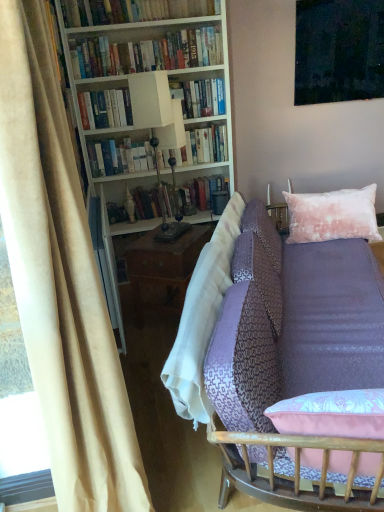
Question: Is hardcover books at center, which is the first book from bottom to top, touching lavender fabric couch at center?

Choices:
 (A) no
 (B) yes

Answer: (A)

Question: Can you confirm if hardcover books at center, which is the first book from bottom to top, is shorter than lavender fabric couch at center?

Choices:
 (A) yes
 (B) no

Answer: (A)

Question: From a real-world perspective, is hardcover books at center, which is the 4th book in top-to-bottom order, below lavender fabric couch at center?

Choices:
 (A) no
 (B) yes

Answer: (A)

Question: Is hardcover books at center, which is the first book from bottom to top, facing towards lavender fabric couch at center?

Choices:
 (A) no
 (B) yes

Answer: (A)

Question: Is the position of hardcover books at center, which is the first book from bottom to top, less distant than that of lavender fabric couch at center?

Choices:
 (A) no
 (B) yes

Answer: (A)

Question: Does hardcover books at center, which is the 4th book in top-to-bottom order, appear on the right side of lavender fabric couch at center?

Choices:
 (A) yes
 (B) no

Answer: (B)

Question: From the image's perspective, is lavender fabric couch at center under velvet pink pillow at upper right?

Choices:
 (A) yes
 (B) no

Answer: (A)

Question: Is lavender fabric couch at center taller than velvet pink pillow at upper right?

Choices:
 (A) no
 (B) yes

Answer: (B)

Question: Are lavender fabric couch at center and velvet pink pillow at upper right located far from each other?

Choices:
 (A) no
 (B) yes

Answer: (A)

Question: Does lavender fabric couch at center appear on the right side of velvet pink pillow at upper right?

Choices:
 (A) no
 (B) yes

Answer: (A)

Question: Considering the relative sizes of lavender fabric couch at center and velvet pink pillow at upper right in the image provided, is lavender fabric couch at center thinner than velvet pink pillow at upper right?

Choices:
 (A) no
 (B) yes

Answer: (A)

Question: Could velvet pink pillow at upper right be considered to be inside lavender fabric couch at center?

Choices:
 (A) no
 (B) yes

Answer: (B)

Question: From the image's perspective, is white matte bookcase at upper left below hardcover books at upper center, the second book from the top?

Choices:
 (A) yes
 (B) no

Answer: (A)